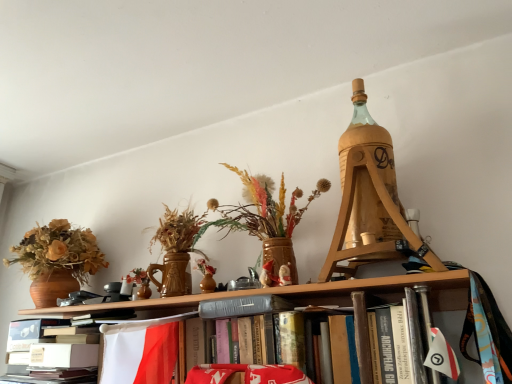
Question: Relative to gray fabric bookshelf at center, is wooden tripod at upper right in front or behind?

Choices:
 (A) behind
 (B) front

Answer: (A)

Question: Based on their sizes in the image, would you say wooden tripod at upper right is bigger or smaller than gray fabric bookshelf at center?

Choices:
 (A) small
 (B) big

Answer: (A)

Question: Which of these objects is positioned farthest from the wooden tripod at upper right?

Choices:
 (A) white paper at lower left
 (B) gray fabric bookshelf at center

Answer: (A)

Question: Estimate the real-world distances between objects in this image. Which object is closer to the white paper at lower left?

Choices:
 (A) gray fabric bookshelf at center
 (B) wooden tripod at upper right

Answer: (A)